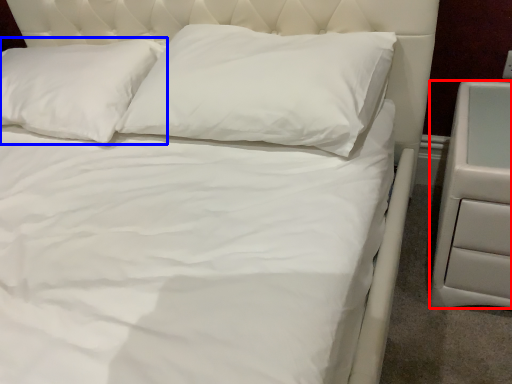
Question: Among these objects, which one is farthest to the camera, nightstand (highlighted by a red box) or pillow (highlighted by a blue box)?

Choices:
 (A) nightstand
 (B) pillow

Answer: (B)